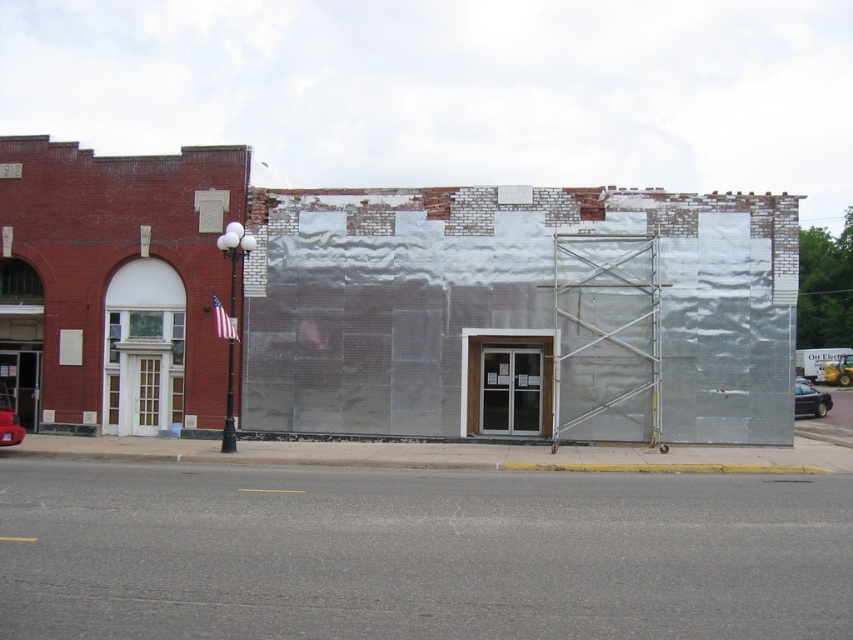
How far apart are shiny black sedan at lower right and metallic red car at lower left?

20.73 meters

Is shiny black sedan at lower right positioned behind metallic red car at lower left?

Yes, shiny black sedan at lower right is behind metallic red car at lower left.

Measure the distance between point (822, 404) and camera.

A distance of 39.47 meters exists between point (822, 404) and camera.

Locate an element on the screen. This screenshot has height=640, width=853. shiny black sedan at lower right is located at coordinates (810, 400).